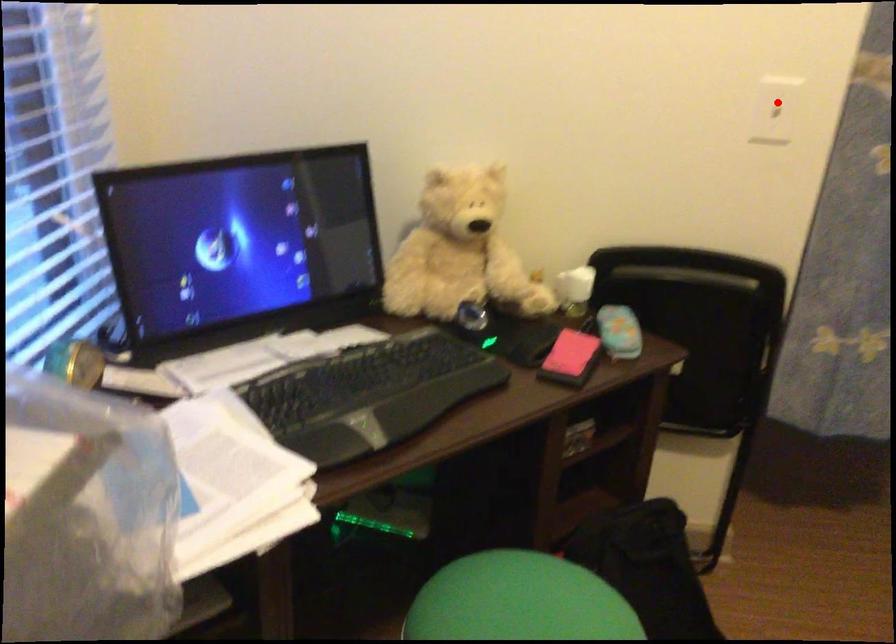
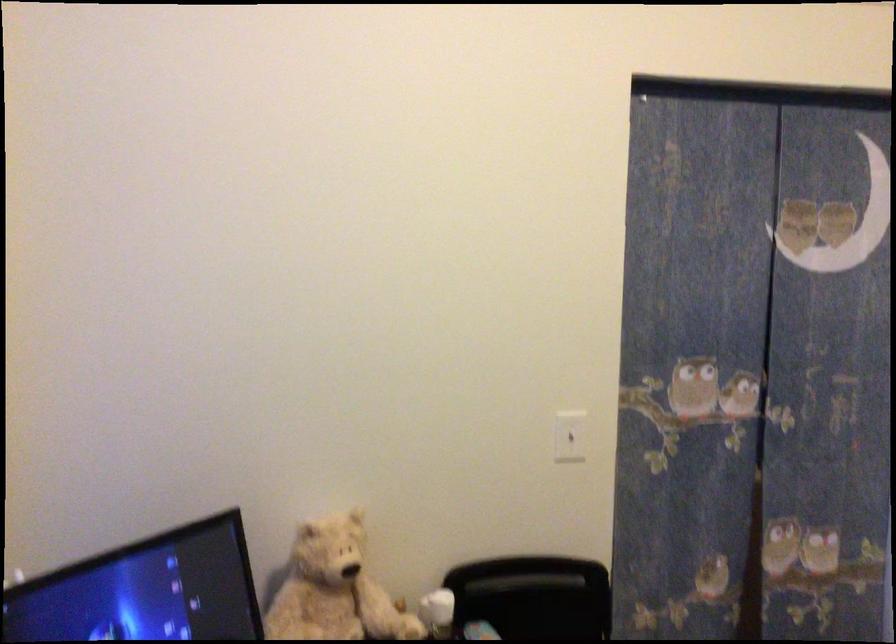
Question: I am providing you with two images of the same scene from different viewpoints. Image1 has a red point marked. In image2, the corresponding 3D location appears at what relative position? Reply with the corresponding letter.

Choices:
 (A) Closer
 (B) Farther

Answer: (B)